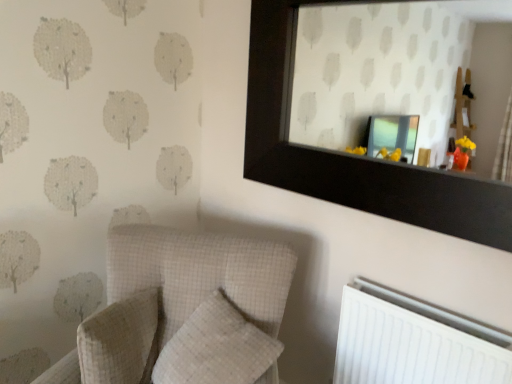
Question: Should I look upward or downward to see white checkered pillow at center, the first pillow viewed from the right?

Choices:
 (A) down
 (B) up

Answer: (A)

Question: Does white checkered pillow at center, which is counted as the 2th pillow, starting from the left, have a greater width compared to white checkered pillow at lower left, the 1th pillow when ordered from left to right?

Choices:
 (A) no
 (B) yes

Answer: (B)

Question: Is white checkered pillow at center, the first pillow viewed from the right, not close to white checkered pillow at lower left, the 1th pillow when ordered from left to right?

Choices:
 (A) no
 (B) yes

Answer: (A)

Question: From a real-world perspective, is white checkered pillow at center, which is counted as the 2th pillow, starting from the left, on white checkered pillow at lower left, the 1th pillow when ordered from left to right?

Choices:
 (A) yes
 (B) no

Answer: (A)

Question: Considering the relative positions of white checkered pillow at center, which is counted as the 2th pillow, starting from the left, and white checkered pillow at lower left, the second pillow in the right-to-left sequence, in the image provided, is white checkered pillow at center, which is counted as the 2th pillow, starting from the left, to the right of white checkered pillow at lower left, the second pillow in the right-to-left sequence, from the viewer's perspective?

Choices:
 (A) no
 (B) yes

Answer: (B)

Question: From the image's perspective, is white checkered pillow at center, which is counted as the 2th pillow, starting from the left, above white checkered pillow at lower left, the 1th pillow when ordered from left to right?

Choices:
 (A) no
 (B) yes

Answer: (A)

Question: Can you confirm if white checkered pillow at center, the first pillow viewed from the right, is thinner than white checkered pillow at lower left, the 1th pillow when ordered from left to right?

Choices:
 (A) no
 (B) yes

Answer: (A)

Question: Does white plastic radiator at lower right appear on the right side of white checkered pillow at center, which is counted as the 2th pillow, starting from the left?

Choices:
 (A) no
 (B) yes

Answer: (B)

Question: Is white plastic radiator at lower right taller than white checkered pillow at center, which is counted as the 2th pillow, starting from the left?

Choices:
 (A) no
 (B) yes

Answer: (B)

Question: Does white plastic radiator at lower right have a larger size compared to white checkered pillow at center, the first pillow viewed from the right?

Choices:
 (A) no
 (B) yes

Answer: (B)

Question: From a real-world perspective, is white plastic radiator at lower right below white checkered pillow at center, the first pillow viewed from the right?

Choices:
 (A) no
 (B) yes

Answer: (B)

Question: Does white plastic radiator at lower right have a smaller size compared to white checkered pillow at center, the first pillow viewed from the right?

Choices:
 (A) no
 (B) yes

Answer: (A)

Question: Is white plastic radiator at lower right positioned in front of white checkered pillow at center, the first pillow viewed from the right?

Choices:
 (A) no
 (B) yes

Answer: (A)

Question: Does white plastic radiator at lower right have a smaller size compared to white checkered pillow at lower left, the 1th pillow when ordered from left to right?

Choices:
 (A) no
 (B) yes

Answer: (A)